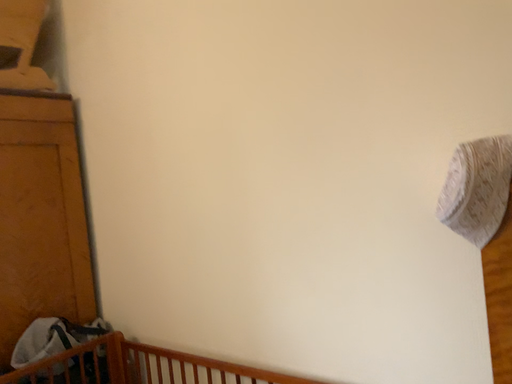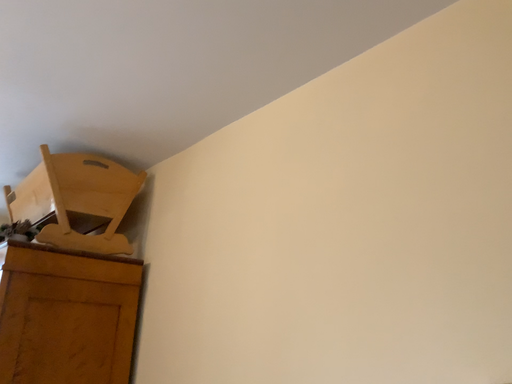
Question: Which way did the camera rotate in the video?

Choices:
 (A) rotated left
 (B) rotated right

Answer: (A)